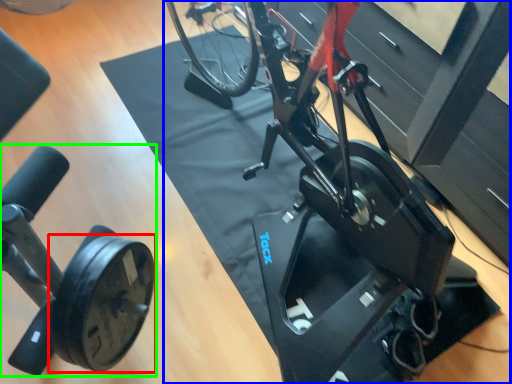
Question: Which object is the closest to the wheel (highlighted by a red box)? Choose among these: stationary bicycle (highlighted by a blue box) or stationary bicycle (highlighted by a green box).

Choices:
 (A) stationary bicycle
 (B) stationary bicycle

Answer: (B)